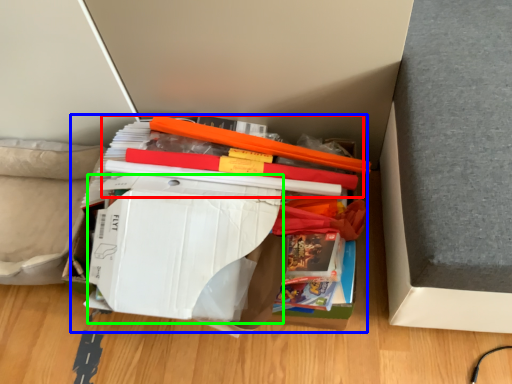
Question: Based on their relative distances, which object is farther from book (highlighted by a red box)? Choose from paperback book (highlighted by a blue box) and paperback book (highlighted by a green box).

Choices:
 (A) paperback book
 (B) paperback book

Answer: (B)